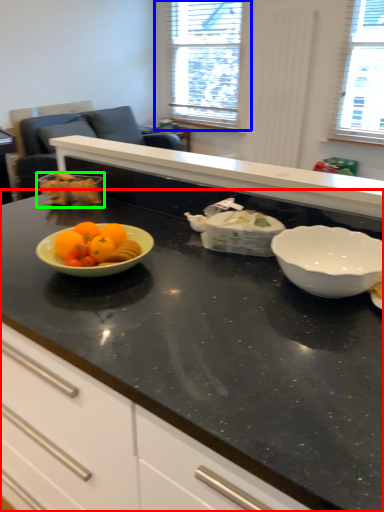
Question: Which object is the farthest from countertop (highlighted by a red box)? Choose among these: window (highlighted by a blue box) or tableware (highlighted by a green box).

Choices:
 (A) window
 (B) tableware

Answer: (A)